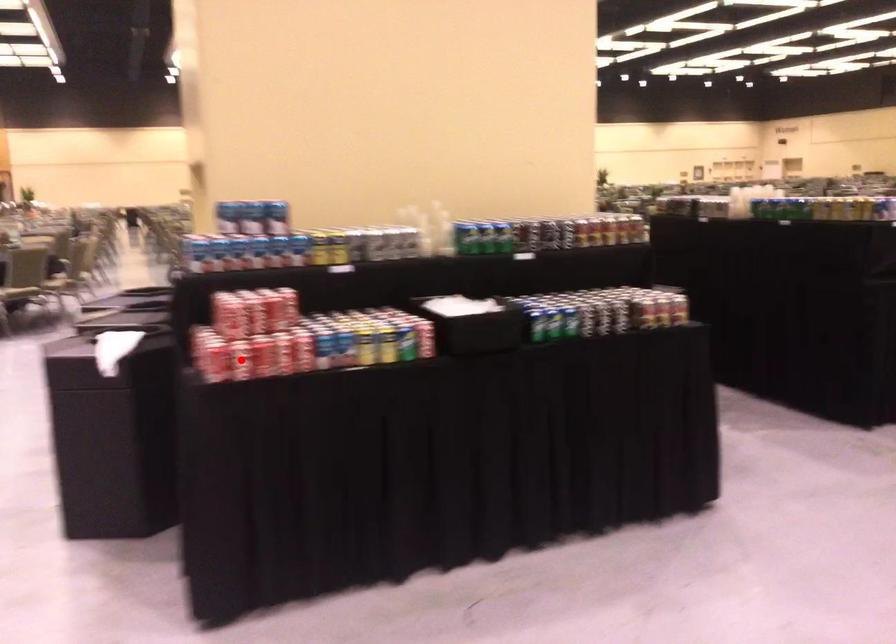
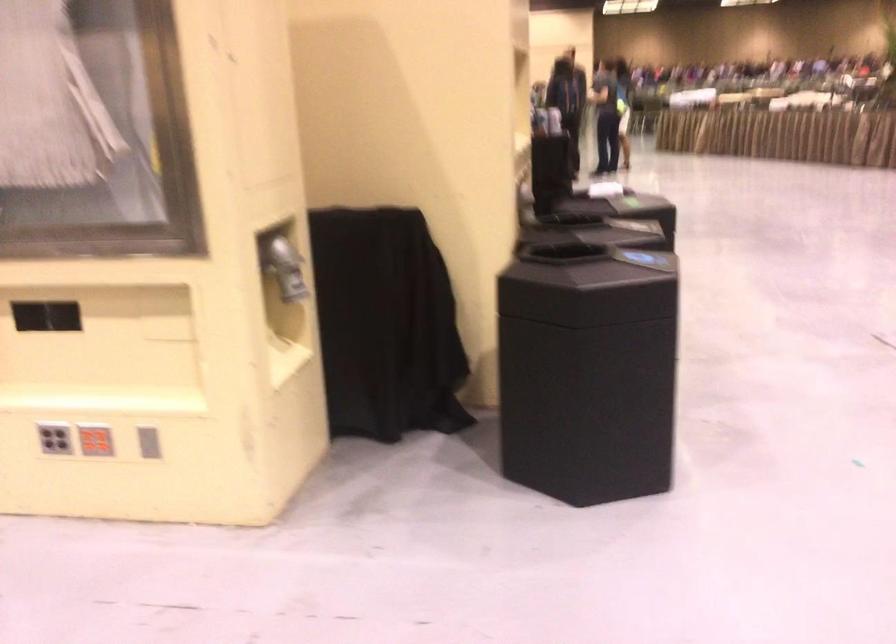
Question: I am providing you with two images of the same scene from different viewpoints. A red point is marked on the first image. Can you still see the location of the red point in image 2?

Choices:
 (A) Yes
 (B) No

Answer: (B)